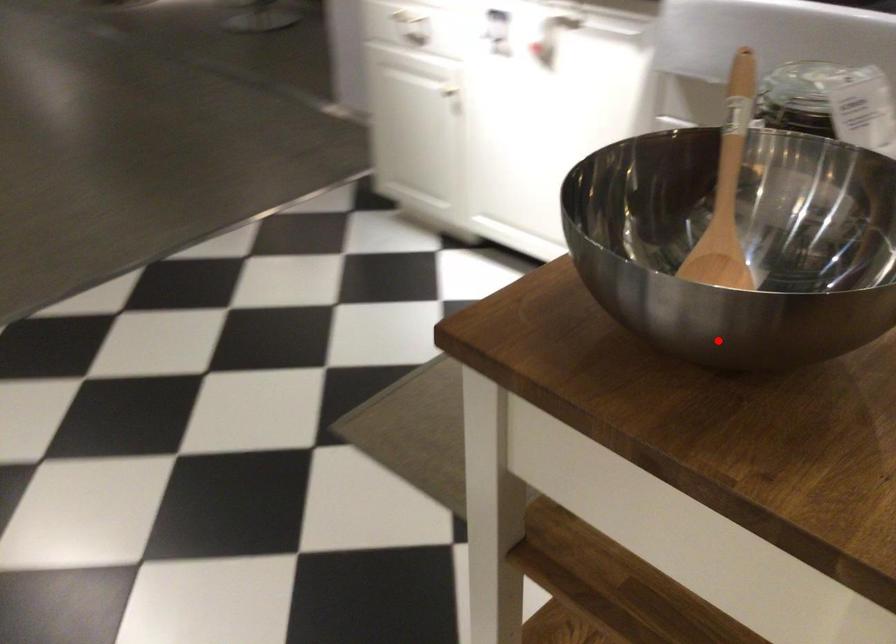
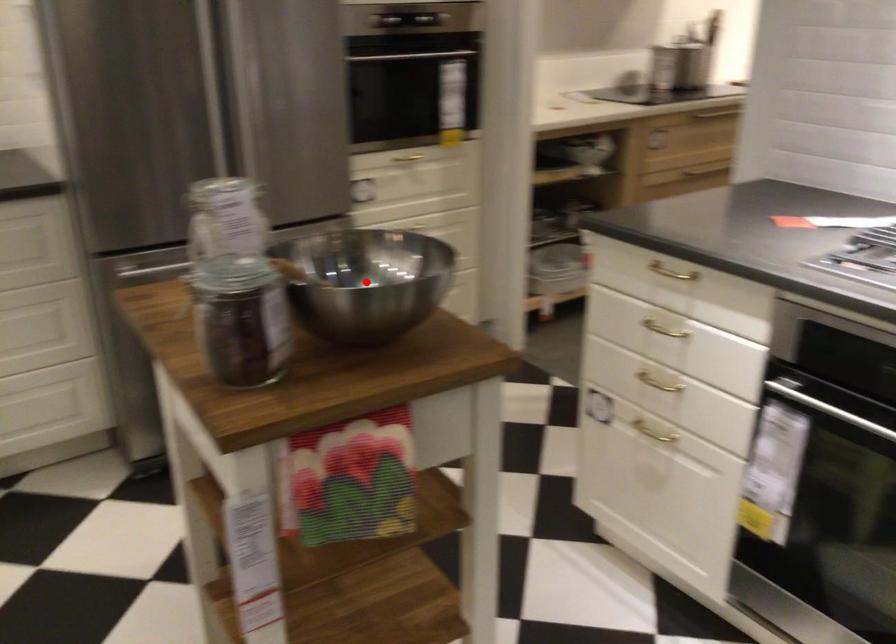
I am providing you with two images of the same scene from different viewpoints. A red point is marked on the first image and another point is marked on the second image. Do the highlighted points in image1 and image2 indicate the same real-world spot?

Yes